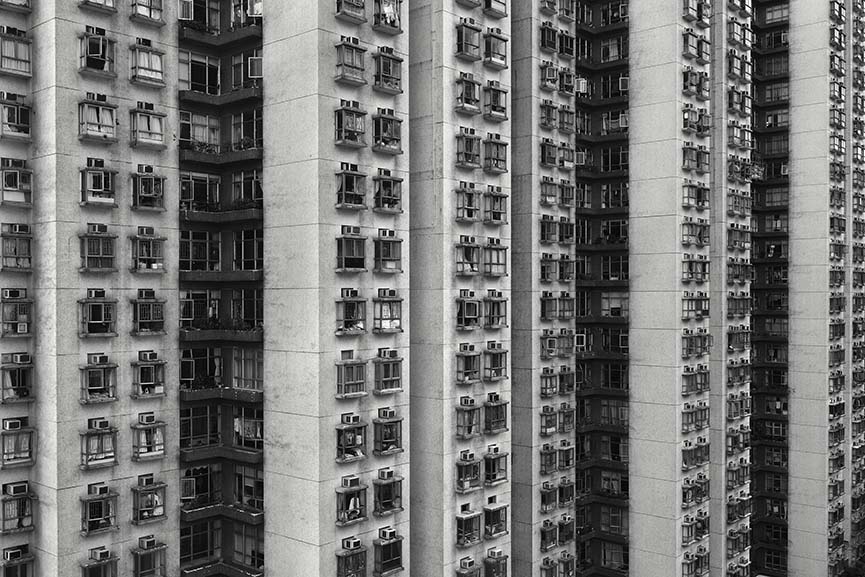
What are the coordinates of `open windows located farthest top left in photo` in the screenshot? It's located at (13, 33), (97, 47).